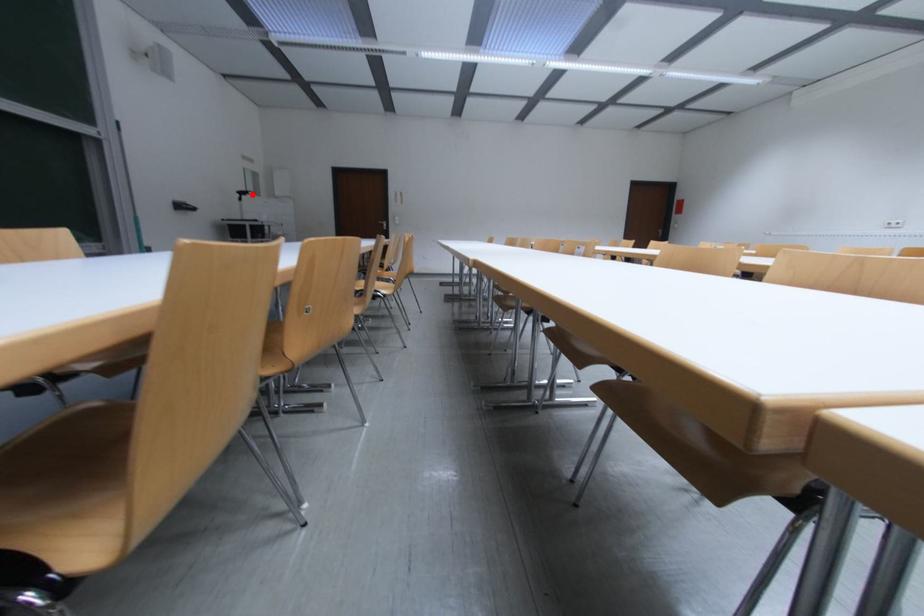
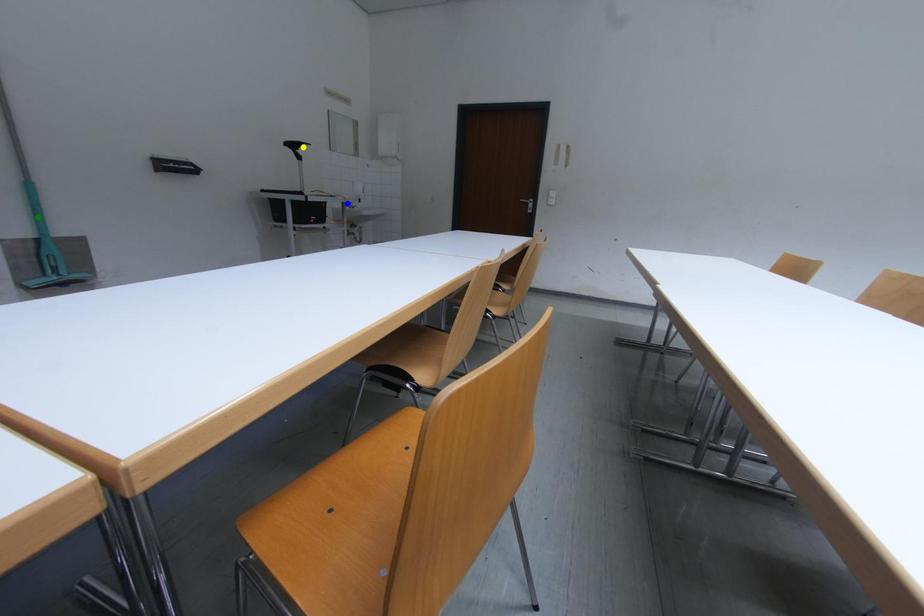
Question: I am providing you with two images of the same scene from different viewpoints. A red point is marked on the first image. You are given multiple points on the second image. Which mark in image 2 goes with the point in image 1?

Choices:
 (A) blue point
 (B) yellow point
 (C) green point

Answer: (B)